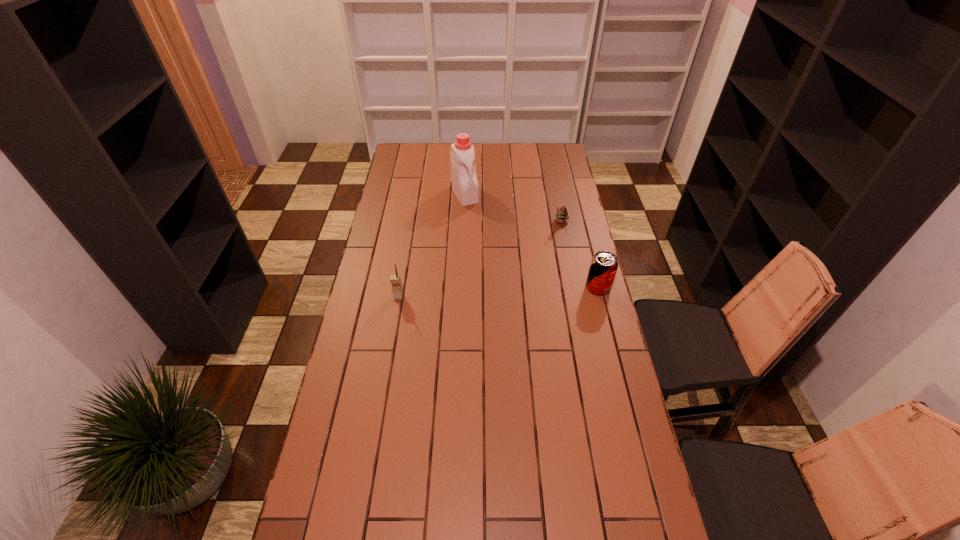
Where is `vacant region located 0.060m on the handle side of the tallest object`? The height and width of the screenshot is (540, 960). vacant region located 0.060m on the handle side of the tallest object is located at coordinates (473, 213).

Locate an element on the screen. The height and width of the screenshot is (540, 960). vacant space situated on the handle side of the tallest object is located at coordinates (485, 235).

Find the location of a particular element. vacant space located on the face of the second farthest object is located at coordinates (529, 280).

This screenshot has height=540, width=960. I want to click on free spot located 0.370m on the face of the second farthest object, so click(526, 285).

The height and width of the screenshot is (540, 960). I want to click on vacant space situated 0.370m on the face of the second farthest object, so click(526, 285).

Locate an element on the screen. Image resolution: width=960 pixels, height=540 pixels. object positioned at the left edge is located at coordinates click(x=395, y=279).

Locate an element on the screen. The height and width of the screenshot is (540, 960). soda can at the right edge is located at coordinates (604, 264).

The width and height of the screenshot is (960, 540). Identify the location of snail that is at the right edge. [562, 214].

In the image, there is a desktop. Where is `blank space at the far edge`? blank space at the far edge is located at coordinates (500, 159).

The width and height of the screenshot is (960, 540). In order to click on vacant space at the near edge of the desktop in this screenshot , I will do `click(493, 519)`.